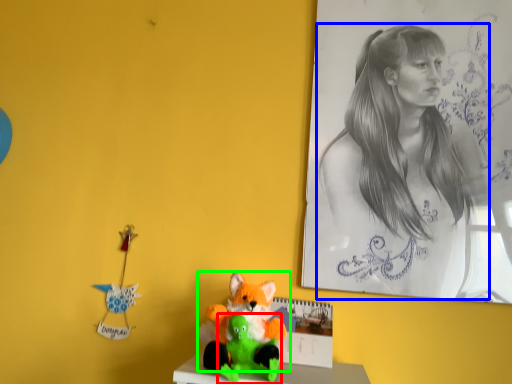
Question: Considering the real-world distances, which object is closest to toy (highlighted by a red box)? woman (highlighted by a blue box) or toy (highlighted by a green box).

Choices:
 (A) woman
 (B) toy

Answer: (B)